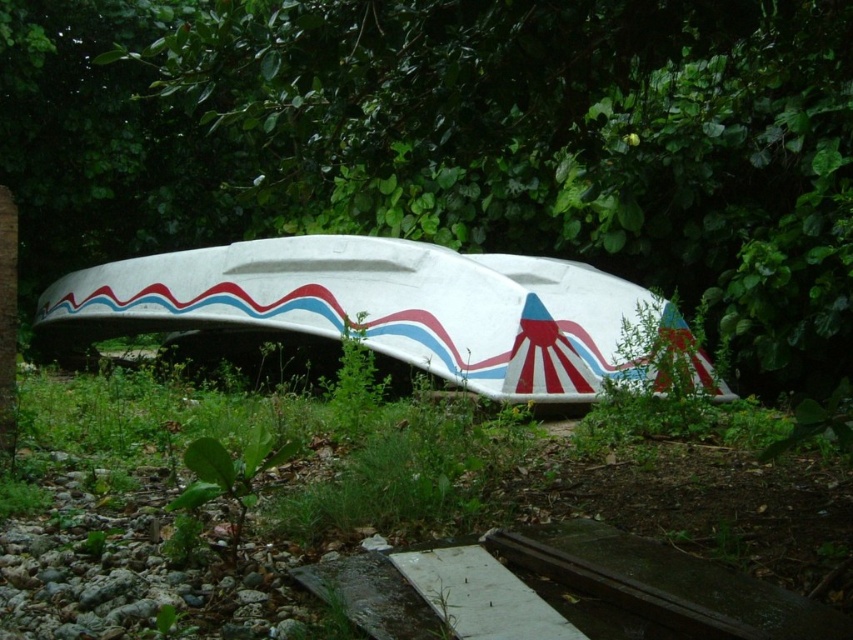
Question: Where is green leafy tree at center located in relation to white glossy boat at center in the image?

Choices:
 (A) right
 (B) left

Answer: (B)

Question: Is green leafy tree at center below white glossy boat at center?

Choices:
 (A) yes
 (B) no

Answer: (B)

Question: Which point is closer to the camera?

Choices:
 (A) white glossy boat at center
 (B) green leafy tree at center

Answer: (B)

Question: Can you confirm if green leafy tree at center is positioned to the right of white glossy boat at center?

Choices:
 (A) no
 (B) yes

Answer: (A)

Question: Which of the following is the farthest from the observer?

Choices:
 (A) white glossy boat at center
 (B) green leafy tree at center

Answer: (A)